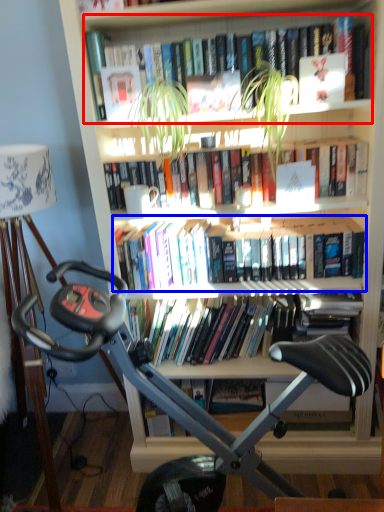
Question: Which point is further to the camera, book (highlighted by a red box) or book (highlighted by a blue box)?

Choices:
 (A) book
 (B) book

Answer: (B)